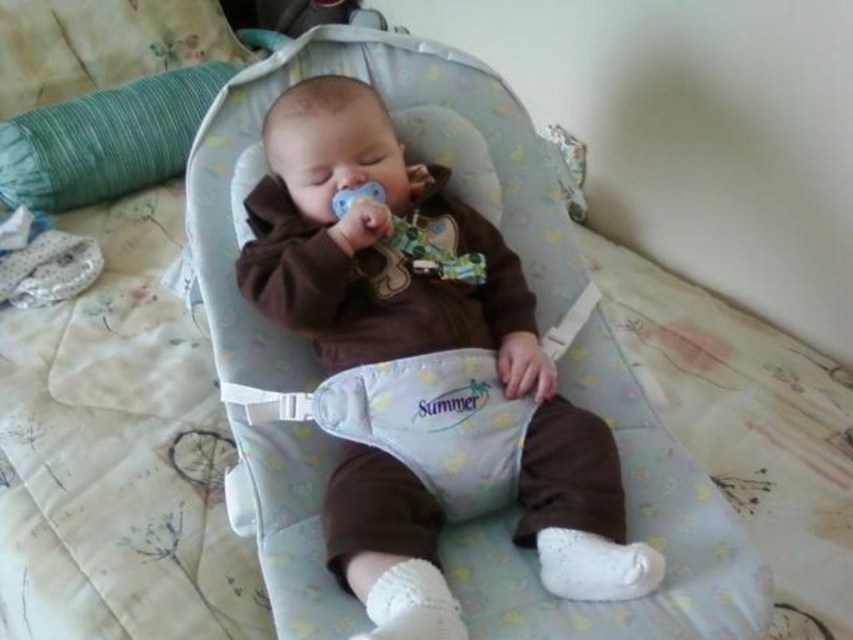
You are a photographer trying to capture a closeup of the green fabric pillow at upper left without the matte brown baby at center blocking the view. Is this possible given their positions?

The matte brown baby at center is in front of the green fabric pillow at upper left, so the baby is blocking the view of the pillow. To capture a closeup of the green fabric pillow at upper left without the baby blocking it, you would need to move the baby or adjust your angle so the baby is no longer in front of the pillow.

You are a photographer taking a picture of the baby in the light blue baby bouncer with a floral pattern. You notice a point at coordinates (422, 371). Where exactly is this point located on the baby?

The point at coordinates (422, 371) is located on the matte brown baby at center.